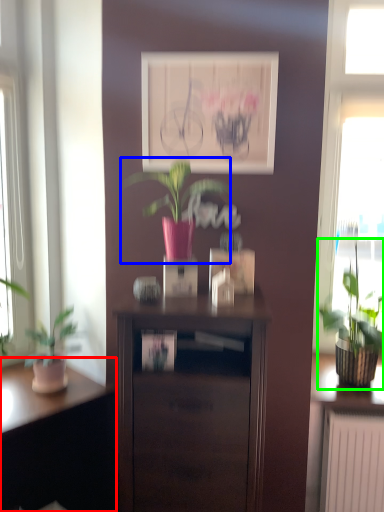
Question: Which object is the closest to the desk (highlighted by a red box)? Choose among these: houseplant (highlighted by a blue box) or houseplant (highlighted by a green box).

Choices:
 (A) houseplant
 (B) houseplant

Answer: (A)